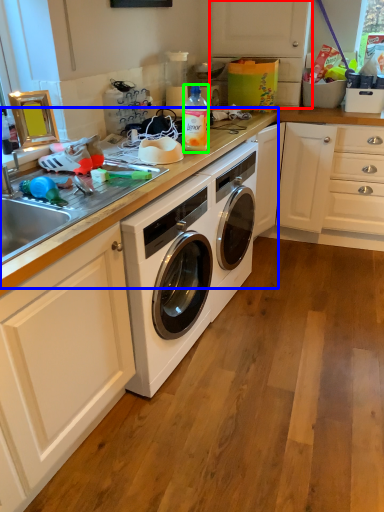
Question: Which is nearer to the cabinetry (highlighted by a red box)? counter top (highlighted by a blue box) or bottle (highlighted by a green box).

Choices:
 (A) counter top
 (B) bottle

Answer: (A)